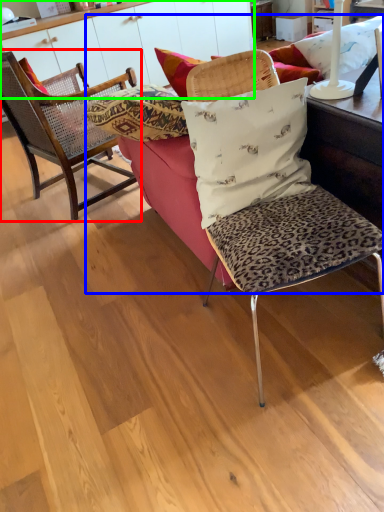
Question: Estimate the real-world distances between objects in this image. Which object is closer to chair (highlighted by a red box), studio couch (highlighted by a blue box) or dresser (highlighted by a green box)?

Choices:
 (A) studio couch
 (B) dresser

Answer: (A)